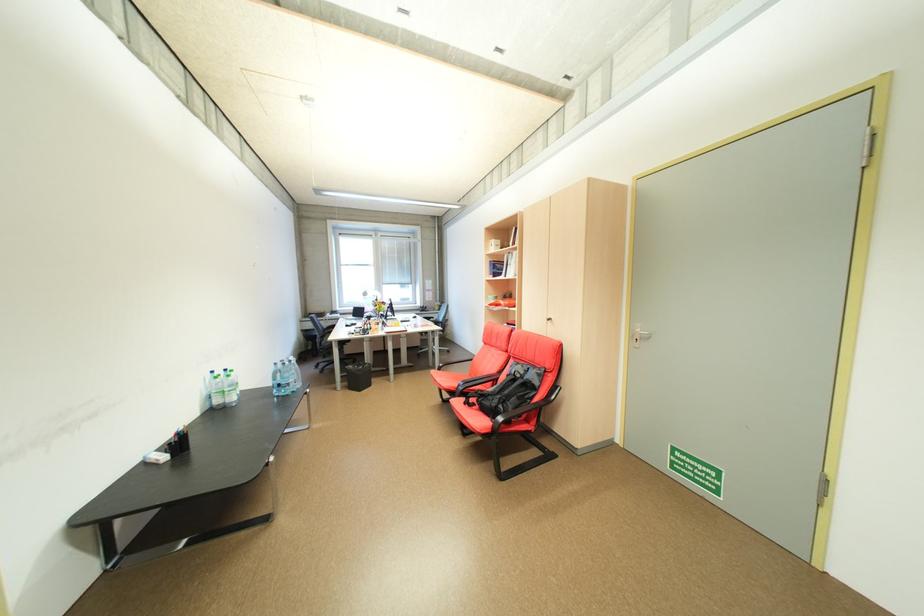
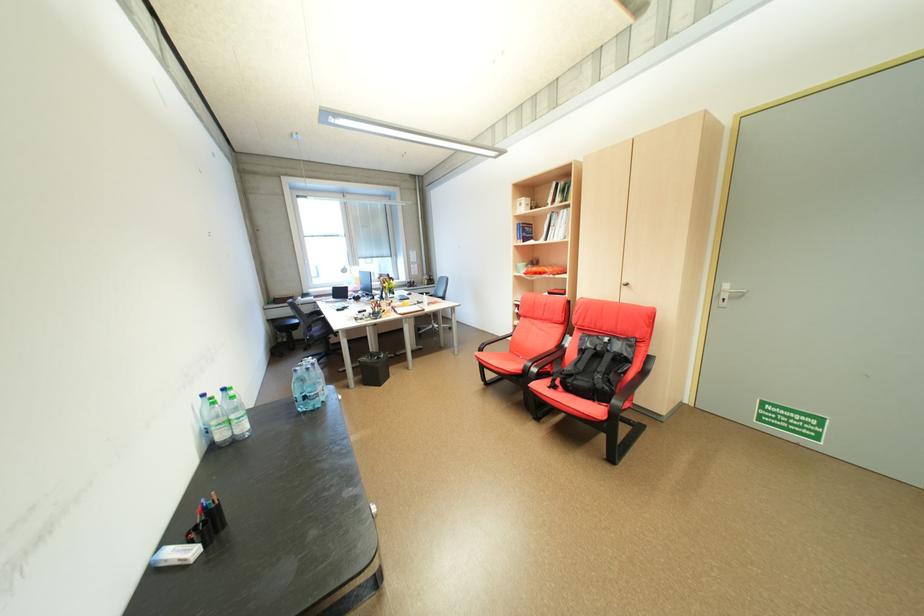
Where in the second image is the point corresponding to (368,383) from the first image?

(382, 377)